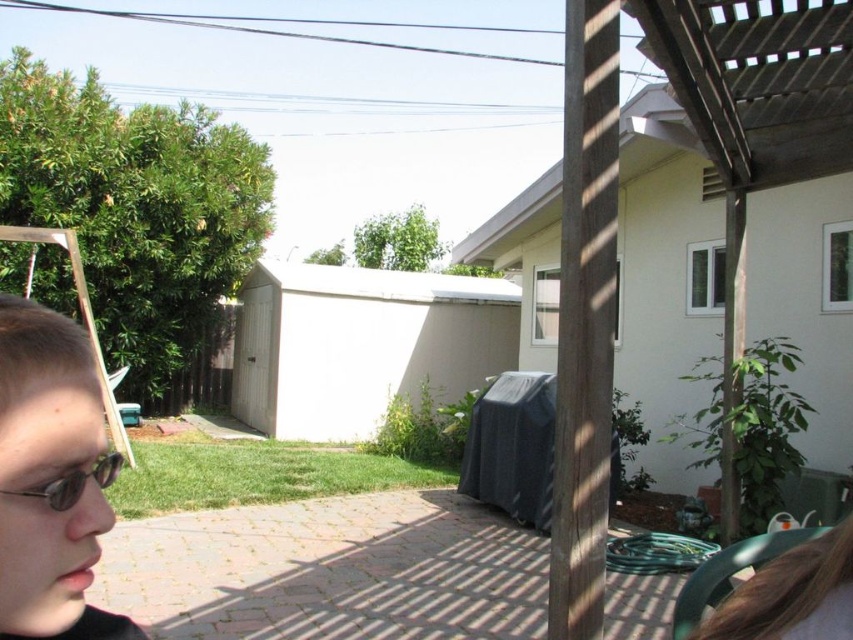
Question: Based on their relative distances, which object is farther from the blonde hair at lower right?

Choices:
 (A) matte black goggles at lower left
 (B) light brown hair at lower left

Answer: (A)

Question: Is light brown hair at lower left behind matte black goggles at lower left?

Choices:
 (A) no
 (B) yes

Answer: (A)

Question: Can you confirm if light brown hair at lower left is smaller than blonde hair at lower right?

Choices:
 (A) yes
 (B) no

Answer: (B)

Question: Is the position of light brown hair at lower left less distant than that of blonde hair at lower right?

Choices:
 (A) yes
 (B) no

Answer: (A)

Question: Considering the real-world distances, which object is closest to the blonde hair at lower right?

Choices:
 (A) matte black goggles at lower left
 (B) light brown hair at lower left

Answer: (B)

Question: Which object is positioned closest to the light brown hair at lower left?

Choices:
 (A) blonde hair at lower right
 (B) matte black goggles at lower left

Answer: (B)